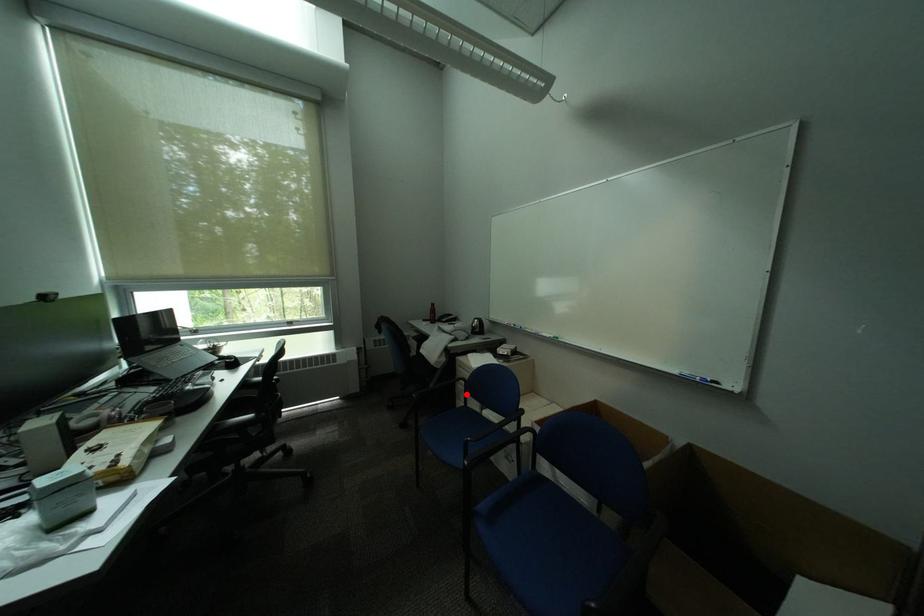
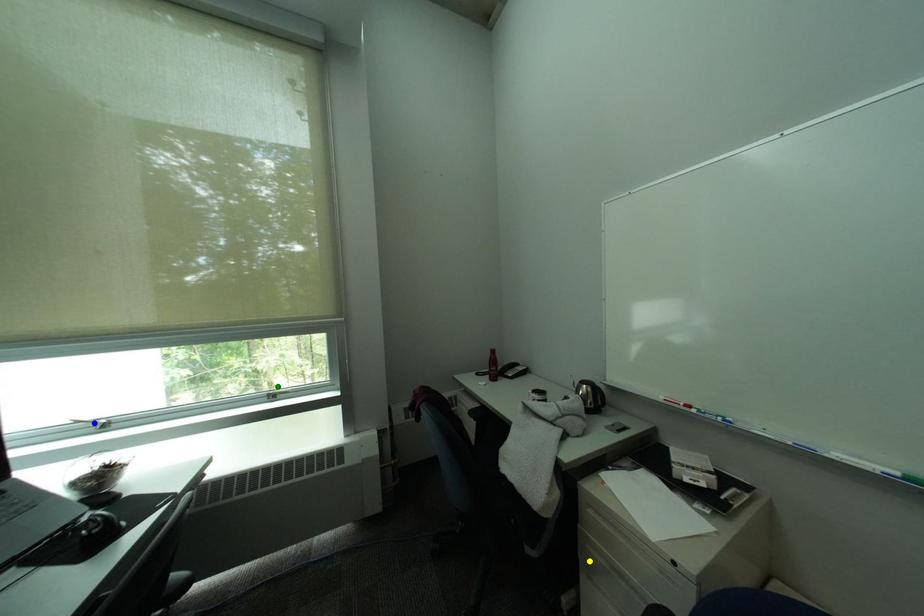
Question: I am providing you with two images of the same scene from different viewpoints. A red point is marked on the first image. You are given multiple points on the second image. In image 2, which mark is for the same physical point as the one in image 1?

Choices:
 (A) blue point
 (B) yellow point
 (C) green point

Answer: (B)